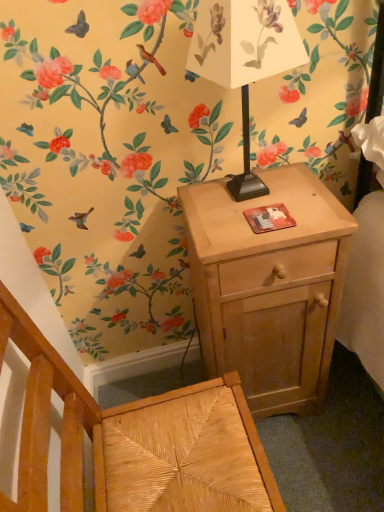
Question: Looking at their shapes, would you say light wood nightstand at right is wider or thinner than woven wood armchair at lower left?

Choices:
 (A) thin
 (B) wide

Answer: (A)

Question: In the image, is light wood nightstand at right positioned in front of or behind woven wood armchair at lower left?

Choices:
 (A) behind
 (B) front

Answer: (A)

Question: Which is farther from the white paper lampshade at upper center?

Choices:
 (A) light wood nightstand at right
 (B) woven wood armchair at lower left

Answer: (B)

Question: Which is nearer to the light wood nightstand at right?

Choices:
 (A) woven wood armchair at lower left
 (B) white paper lampshade at upper center

Answer: (A)